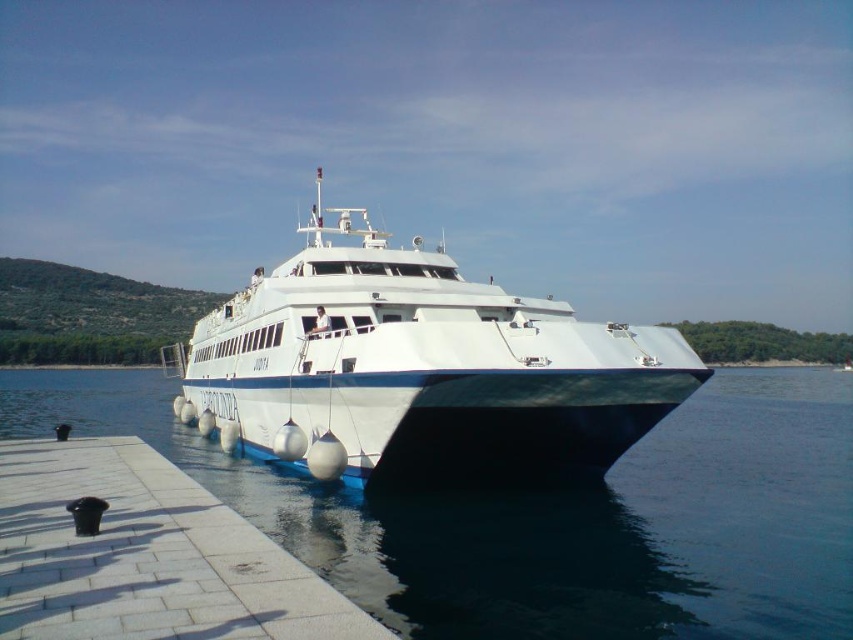
Question: Can you confirm if white glossy boat at center is positioned below white tile dock at lower left?

Choices:
 (A) yes
 (B) no

Answer: (B)

Question: Which point appears closest to the camera in this image?

Choices:
 (A) (210, 516)
 (B) (799, 556)
 (C) (241, 323)

Answer: (A)

Question: Which point is farther to the camera?

Choices:
 (A) white tile dock at lower left
 (B) white glossy boat at center

Answer: (B)

Question: Which of the following is the farthest from the observer?

Choices:
 (A) white tile dock at lower left
 (B) white glossy boat at center

Answer: (B)

Question: Can you confirm if clear blue water at center is wider than white glossy boat at center?

Choices:
 (A) yes
 (B) no

Answer: (A)

Question: Observing the image, what is the correct spatial positioning of clear blue water at center in reference to white glossy boat at center?

Choices:
 (A) left
 (B) right

Answer: (B)